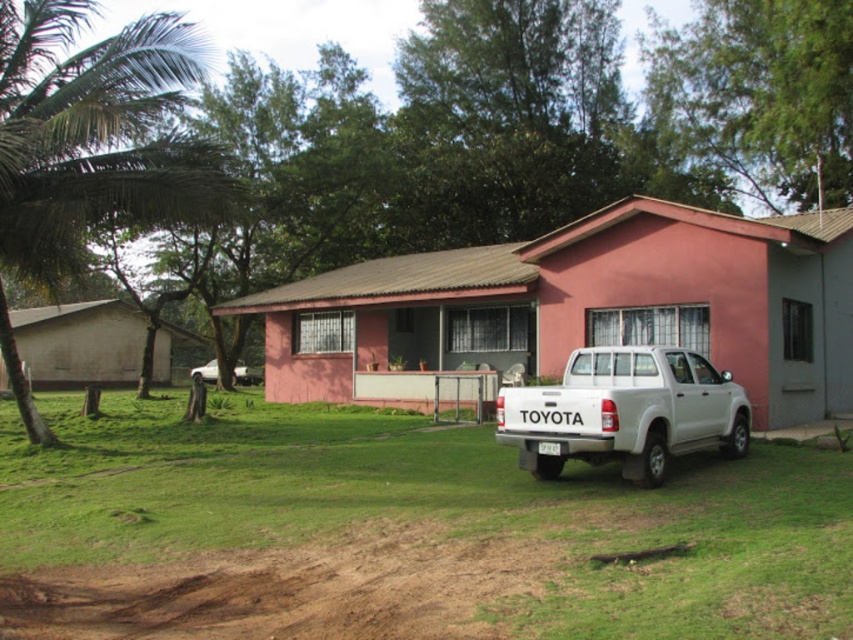
Question: Can you confirm if brown sandy dirt track at lower center is smaller than white matte truck at lower left?

Choices:
 (A) yes
 (B) no

Answer: (A)

Question: Among these objects, which one is farthest from the camera?

Choices:
 (A) white matte truck at lower left
 (B) green grass at lower center

Answer: (A)

Question: Which object is positioned closest to the brown sandy dirt track at lower center?

Choices:
 (A) green grass at lower center
 (B) green leafy palm tree at left
 (C) white matte pickup truck at lower right

Answer: (A)

Question: Which object appears farthest from the camera in this image?

Choices:
 (A) green grass at lower center
 (B) white matte pickup truck at lower right

Answer: (B)

Question: Does white matte pickup truck at lower right have a greater width compared to white matte truck at lower left?

Choices:
 (A) yes
 (B) no

Answer: (B)

Question: Is green grass at lower center above white matte truck at lower left?

Choices:
 (A) no
 (B) yes

Answer: (A)